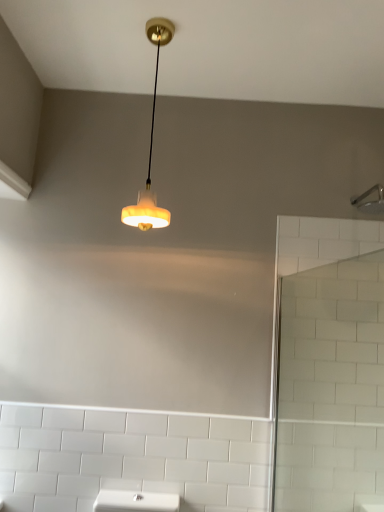
Question: Should I look upward or downward to see white glass screen door at right?

Choices:
 (A) down
 (B) up

Answer: (A)

Question: From the image's perspective, is silver metallic shower head at upper right located above matte white lampshade at upper center?

Choices:
 (A) yes
 (B) no

Answer: (B)

Question: Is silver metallic shower head at upper right completely or partially outside of matte white lampshade at upper center?

Choices:
 (A) no
 (B) yes

Answer: (B)

Question: Could matte white lampshade at upper center be considered to be inside silver metallic shower head at upper right?

Choices:
 (A) no
 (B) yes

Answer: (A)

Question: Is silver metallic shower head at upper right at the left side of matte white lampshade at upper center?

Choices:
 (A) yes
 (B) no

Answer: (B)

Question: Is silver metallic shower head at upper right shorter than matte white lampshade at upper center?

Choices:
 (A) no
 (B) yes

Answer: (B)

Question: Are silver metallic shower head at upper right and matte white lampshade at upper center far apart?

Choices:
 (A) no
 (B) yes

Answer: (B)

Question: From the image's perspective, is white glass screen door at right on matte white lampshade at upper center?

Choices:
 (A) no
 (B) yes

Answer: (A)

Question: Is white glass screen door at right facing towards matte white lampshade at upper center?

Choices:
 (A) no
 (B) yes

Answer: (A)

Question: Considering the relative sizes of white glass screen door at right and matte white lampshade at upper center in the image provided, is white glass screen door at right bigger than matte white lampshade at upper center?

Choices:
 (A) no
 (B) yes

Answer: (B)

Question: From a real-world perspective, does white glass screen door at right sit lower than matte white lampshade at upper center?

Choices:
 (A) no
 (B) yes

Answer: (B)

Question: Does white glass screen door at right have a lesser width compared to matte white lampshade at upper center?

Choices:
 (A) no
 (B) yes

Answer: (A)

Question: From the image's perspective, is white glass screen door at right beneath matte white lampshade at upper center?

Choices:
 (A) yes
 (B) no

Answer: (A)

Question: Considering the relative sizes of white glass screen door at right and silver metallic shower head at upper right in the image provided, is white glass screen door at right smaller than silver metallic shower head at upper right?

Choices:
 (A) no
 (B) yes

Answer: (A)